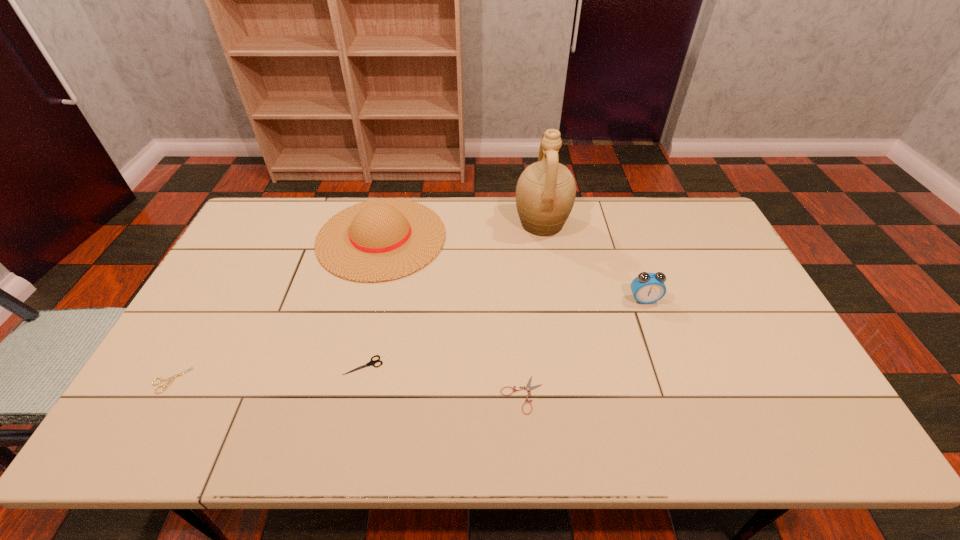
This screenshot has width=960, height=540. I want to click on vacant space located on the right of the tallest object, so click(598, 223).

Where is `free space located on the right of the bonnet`? free space located on the right of the bonnet is located at coordinates (555, 238).

At what (x,y) coordinates should I click in order to perform the action: click on vacant region located on the face of the third farthest object. Please return your answer as a coordinate pair (x, y). The image size is (960, 540). Looking at the image, I should click on (690, 429).

Locate an element on the screen. This screenshot has height=540, width=960. vacant space located on the back of the fourth tallest object is located at coordinates (383, 275).

At what (x,y) coordinates should I click in order to perform the action: click on vacant area situated on the right of the leftmost object. Please return your answer as a coordinate pair (x, y). This screenshot has width=960, height=540. Looking at the image, I should click on (284, 380).

In order to click on vacant space situated 0.390m on the back of the shortest shears in this screenshot , I will do `click(513, 268)`.

You are a GUI agent. You are given a task and a screenshot of the screen. Output one action in this format:
    pyautogui.click(x=<x>, y=<y>)
    Task: Click on the pitcher that is at the far edge
    The width and height of the screenshot is (960, 540).
    Given the screenshot: What is the action you would take?
    pyautogui.click(x=546, y=190)

The image size is (960, 540). What are the coordinates of `bonnet located at the far edge` in the screenshot? It's located at (380, 240).

Find the location of a particular element. object present at the near edge is located at coordinates (528, 388).

Where is `object located in the left edge section of the desktop`? Image resolution: width=960 pixels, height=540 pixels. object located in the left edge section of the desktop is located at coordinates (171, 379).